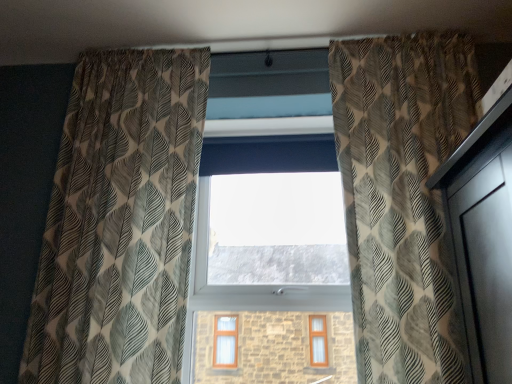
The image size is (512, 384). What do you see at coordinates (270, 260) in the screenshot? I see `transparent glass window at center` at bounding box center [270, 260].

The width and height of the screenshot is (512, 384). In order to click on textured beige curtain at left, which is the first curtain in left-to-right order in this screenshot , I will do `click(120, 222)`.

You are a GUI agent. You are given a task and a screenshot of the screen. Output one action in this format:
    pyautogui.click(x=<x>, y=<y>)
    Task: Click on the printed fabric curtain at right, placed as the 1th curtain when sorted from right to left
    
    Given the screenshot: What is the action you would take?
    pyautogui.click(x=401, y=196)

In order to click on transparent glass window at center in this screenshot , I will do `click(270, 260)`.

From a real-world perspective, relative to transparent glass window at center, is textured beige curtain at left, which is the first curtain in left-to-right order, vertically above or below?

From a real-world perspective, textured beige curtain at left, which is the first curtain in left-to-right order, is physically above transparent glass window at center.

Who is shorter, textured beige curtain at left, which is the first curtain in left-to-right order, or transparent glass window at center?

Standing shorter between the two is transparent glass window at center.

Is textured beige curtain at left, which is the first curtain in left-to-right order, wider or thinner than transparent glass window at center?

Clearly, textured beige curtain at left, which is the first curtain in left-to-right order, has more width compared to transparent glass window at center.

Is the position of textured beige curtain at left, which is the second curtain from right to left, less distant than that of transparent glass window at center?

Yes, textured beige curtain at left, which is the second curtain from right to left, is in front of transparent glass window at center.

Which is more to the left, textured beige curtain at left, which is the second curtain from right to left, or printed fabric curtain at right, the 2th curtain positioned from the left?

From the viewer's perspective, textured beige curtain at left, which is the second curtain from right to left, appears more on the left side.

From the image's perspective, which is below, textured beige curtain at left, which is the second curtain from right to left, or printed fabric curtain at right, the 2th curtain positioned from the left?

textured beige curtain at left, which is the second curtain from right to left, appears lower in the image.

From a real-world perspective, which is physically above, textured beige curtain at left, which is the first curtain in left-to-right order, or printed fabric curtain at right, placed as the 1th curtain when sorted from right to left?

printed fabric curtain at right, placed as the 1th curtain when sorted from right to left, from a real-world perspective.

Does textured beige curtain at left, which is the first curtain in left-to-right order, have a smaller size compared to printed fabric curtain at right, the 2th curtain positioned from the left?

Yes.

From a real-world perspective, is printed fabric curtain at right, placed as the 1th curtain when sorted from right to left, located higher than textured beige curtain at left, which is the first curtain in left-to-right order?

Yes, from a real-world perspective, printed fabric curtain at right, placed as the 1th curtain when sorted from right to left, is on top of textured beige curtain at left, which is the first curtain in left-to-right order.

Is printed fabric curtain at right, the 2th curtain positioned from the left, smaller than textured beige curtain at left, which is the second curtain from right to left?

Incorrect, printed fabric curtain at right, the 2th curtain positioned from the left, is not smaller in size than textured beige curtain at left, which is the second curtain from right to left.

Does printed fabric curtain at right, the 2th curtain positioned from the left, turn towards textured beige curtain at left, which is the second curtain from right to left?

No, printed fabric curtain at right, the 2th curtain positioned from the left, is not facing towards textured beige curtain at left, which is the second curtain from right to left.

Can you tell me how much printed fabric curtain at right, placed as the 1th curtain when sorted from right to left, and textured beige curtain at left, which is the second curtain from right to left, differ in facing direction?

0.000382 degrees.

Can you confirm if printed fabric curtain at right, the 2th curtain positioned from the left, is positioned to the right of transparent glass window at center?

Correct, you'll find printed fabric curtain at right, the 2th curtain positioned from the left, to the right of transparent glass window at center.

Is printed fabric curtain at right, placed as the 1th curtain when sorted from right to left, outside of transparent glass window at center?

printed fabric curtain at right, placed as the 1th curtain when sorted from right to left, is positioned outside transparent glass window at center.

Could you tell me if printed fabric curtain at right, the 2th curtain positioned from the left, is facing transparent glass window at center?

No, printed fabric curtain at right, the 2th curtain positioned from the left, is not aimed at transparent glass window at center.

Does point (273, 300) appear closer or farther from the camera than point (387, 216)?

Clearly, point (273, 300) is more distant from the camera than point (387, 216).

Is transparent glass window at center positioned before printed fabric curtain at right, placed as the 1th curtain when sorted from right to left?

No, the depth of transparent glass window at center is greater than that of printed fabric curtain at right, placed as the 1th curtain when sorted from right to left.

Which curtain is the 2nd one when counting from the front of the transparent glass window at center? Please provide its 2D coordinates.

[(401, 196)]

Could you measure the distance between transparent glass window at center and printed fabric curtain at right, the 2th curtain positioned from the left?

The distance of transparent glass window at center from printed fabric curtain at right, the 2th curtain positioned from the left, is 23.49 inches.

Is transparent glass window at center not within textured beige curtain at left, which is the first curtain in left-to-right order?

transparent glass window at center lies outside textured beige curtain at left, which is the first curtain in left-to-right order,'s area.

Does transparent glass window at center appear on the left side of textured beige curtain at left, which is the first curtain in left-to-right order?

In fact, transparent glass window at center is to the right of textured beige curtain at left, which is the first curtain in left-to-right order.

Which of these two, transparent glass window at center or textured beige curtain at left, which is the second curtain from right to left, is bigger?

With larger size is textured beige curtain at left, which is the second curtain from right to left.

Identify the location of bay window located behind the textured beige curtain at left, which is the first curtain in left-to-right order. The height and width of the screenshot is (384, 512). (270, 260).

Locate an element on the screen. curtain in front of the textured beige curtain at left, which is the second curtain from right to left is located at coordinates (401, 196).

Consider the image. Looking at the image, which one is located further to printed fabric curtain at right, placed as the 1th curtain when sorted from right to left, transparent glass window at center or textured beige curtain at left, which is the second curtain from right to left?

textured beige curtain at left, which is the second curtain from right to left, lies further to printed fabric curtain at right, placed as the 1th curtain when sorted from right to left, than the other object.

Considering their positions, is printed fabric curtain at right, placed as the 1th curtain when sorted from right to left, positioned closer to textured beige curtain at left, which is the first curtain in left-to-right order, than transparent glass window at center?

Among the two, transparent glass window at center is located nearer to textured beige curtain at left, which is the first curtain in left-to-right order.

Based on their spatial positions, is textured beige curtain at left, which is the first curtain in left-to-right order, or transparent glass window at center further from printed fabric curtain at right, placed as the 1th curtain when sorted from right to left?

textured beige curtain at left, which is the first curtain in left-to-right order.

When comparing their distances from transparent glass window at center, does printed fabric curtain at right, placed as the 1th curtain when sorted from right to left, or textured beige curtain at left, which is the first curtain in left-to-right order, seem further?

The object further to transparent glass window at center is printed fabric curtain at right, placed as the 1th curtain when sorted from right to left.

When comparing their distances from textured beige curtain at left, which is the first curtain in left-to-right order, does transparent glass window at center or printed fabric curtain at right, the 2th curtain positioned from the left, seem closer?

transparent glass window at center is closer to textured beige curtain at left, which is the first curtain in left-to-right order.

Looking at the image, which one is located closer to transparent glass window at center, textured beige curtain at left, which is the first curtain in left-to-right order, or printed fabric curtain at right, the 2th curtain positioned from the left?

Among the two, textured beige curtain at left, which is the first curtain in left-to-right order, is located nearer to transparent glass window at center.

Identify the location of bay window between textured beige curtain at left, which is the second curtain from right to left, and printed fabric curtain at right, placed as the 1th curtain when sorted from right to left. This screenshot has height=384, width=512. (270, 260).